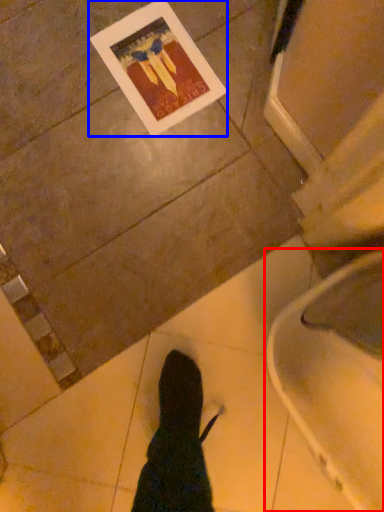
Question: Which object appears farthest to the camera in this image, toilet (highlighted by a red box) or postcard (highlighted by a blue box)?

Choices:
 (A) toilet
 (B) postcard

Answer: (B)